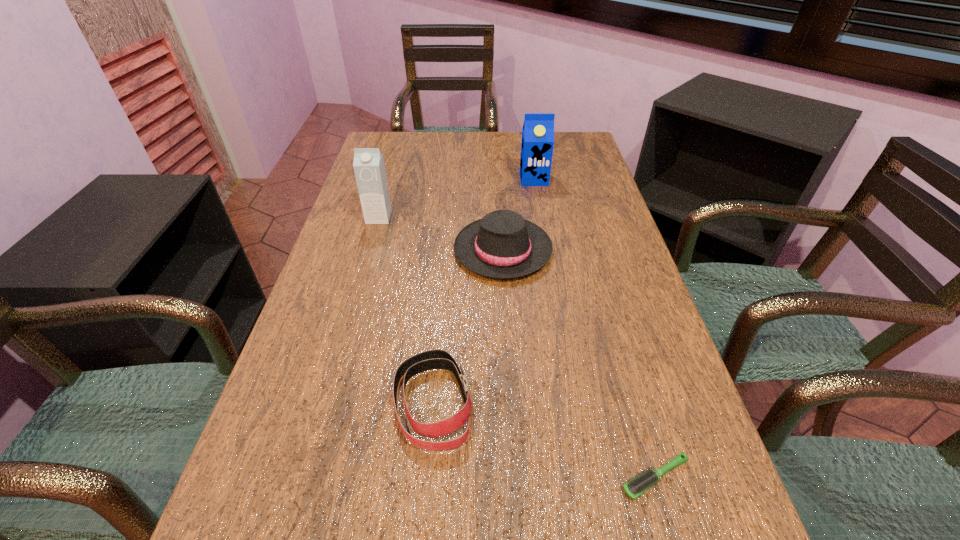
Find the location of a particular element. the closest object to the second nearest object is located at coordinates (503, 245).

Select which object is the closest to the leftmost object. Please provide its 2D coordinates. Your answer should be formatted as a tuple, i.e. [(x, y)], where the tuple contains the x and y coordinates of a point satisfying the conditions above.

[(503, 245)]

This screenshot has height=540, width=960. In order to click on vacant space that satisfies the following two spatial constraints: 1. with the cap open on the right carton; 2. on the right side of the nearest object in this screenshot , I will do `click(585, 477)`.

In order to click on vacant space that satisfies the following two spatial constraints: 1. on the front label of the left carton; 2. on the right side of the dress hat in this screenshot , I will do `click(370, 250)`.

The height and width of the screenshot is (540, 960). What are the coordinates of `free region that satisfies the following two spatial constraints: 1. on the back side of the dress hat; 2. on the left side of the fourth tallest object` in the screenshot? It's located at (446, 250).